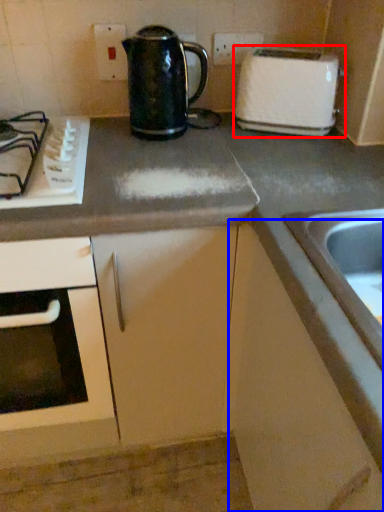
Question: Which object is closer to the camera taking this photo, toaster (highlighted by a red box) or cabinetry (highlighted by a blue box)?

Choices:
 (A) toaster
 (B) cabinetry

Answer: (B)